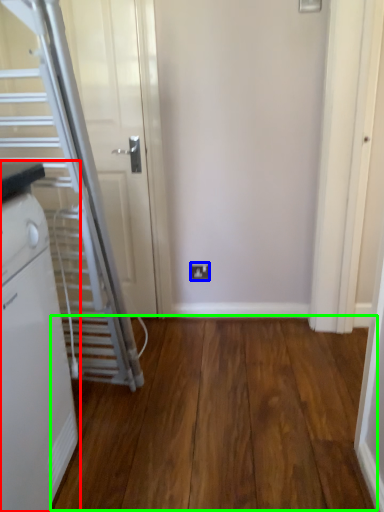
Question: Which is nearer to the home appliance (highlighted by a red box)? electric outlet (highlighted by a blue box) or hardwood (highlighted by a green box).

Choices:
 (A) electric outlet
 (B) hardwood

Answer: (B)